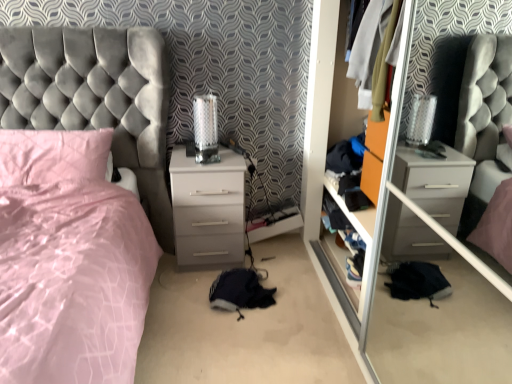
This screenshot has height=384, width=512. Identify the location of free spot below transparent glass door at center (from a real-world perspective). (412, 334).